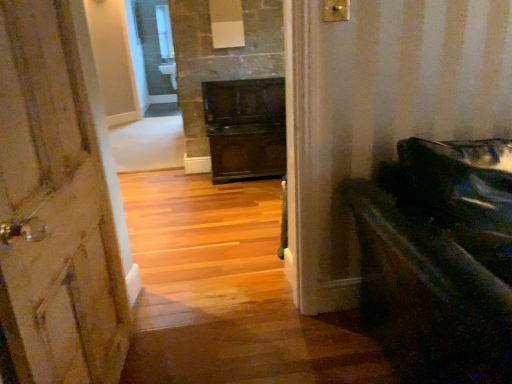
Question: Looking at their shapes, would you say wooden door at left is wider or thinner than shiny black piano at right?

Choices:
 (A) wide
 (B) thin

Answer: (B)

Question: In the image, is wooden door at left positioned in front of or behind shiny black piano at right?

Choices:
 (A) front
 (B) behind

Answer: (A)

Question: From a real-world perspective, is wooden door at left positioned above or below shiny black piano at right?

Choices:
 (A) below
 (B) above

Answer: (B)

Question: Is shiny black piano at right taller or shorter than wooden door at left?

Choices:
 (A) tall
 (B) short

Answer: (B)

Question: Is shiny black piano at right inside the boundaries of wooden door at left, or outside?

Choices:
 (A) outside
 (B) inside

Answer: (A)

Question: From the image's perspective, is shiny black piano at right located above or below wooden door at left?

Choices:
 (A) above
 (B) below

Answer: (B)

Question: Is shiny black piano at right in front of or behind wooden door at left in the image?

Choices:
 (A) front
 (B) behind

Answer: (B)